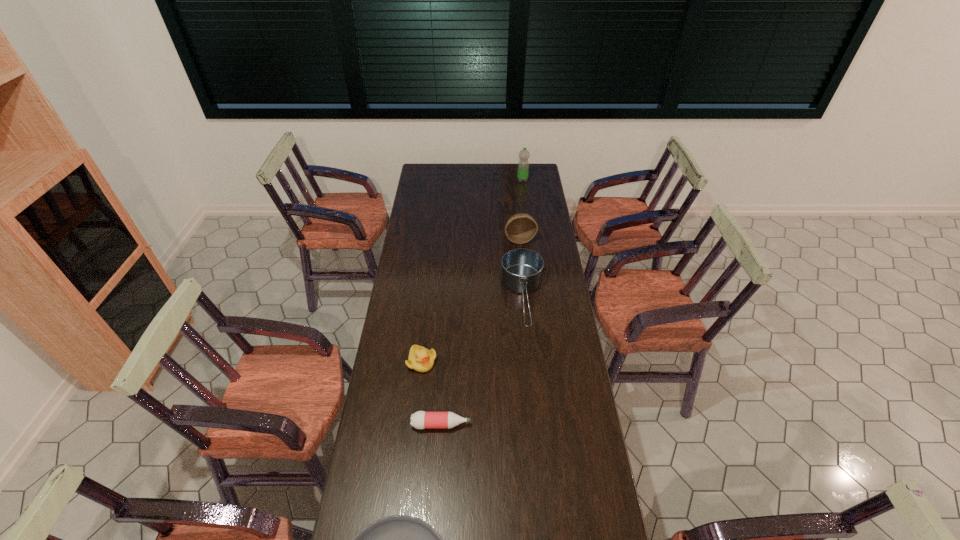
Find the location of `free spot between the bottle and the third tallest object`. free spot between the bottle and the third tallest object is located at coordinates (482, 362).

Where is `vacant area that lies between the fifth farthest object and the bowl`? vacant area that lies between the fifth farthest object and the bowl is located at coordinates (481, 332).

Find the location of a particular element. The image size is (960, 540). free spot between the second shortest object and the tallest object is located at coordinates (482, 302).

This screenshot has width=960, height=540. I want to click on free space between the bottle and the farthest object, so click(482, 302).

Locate an element on the screen. free area in between the duckling and the fourth shortest object is located at coordinates (472, 330).

Locate which object ranks second in proximity to the duckling. Please provide its 2D coordinates. Your answer should be formatted as a tuple, i.e. [(x, y)], where the tuple contains the x and y coordinates of a point satisfying the conditions above.

[(521, 269)]

Locate which object ranks second in proximity to the tallest object. Please provide its 2D coordinates. Your answer should be formatted as a tuple, i.e. [(x, y)], where the tuple contains the x and y coordinates of a point satisfying the conditions above.

[(521, 269)]

This screenshot has height=540, width=960. Find the location of `vacant point that satisfies the following two spatial constraints: 1. on the front side of the tallest object; 2. with the cap open on the second nearest object`. vacant point that satisfies the following two spatial constraints: 1. on the front side of the tallest object; 2. with the cap open on the second nearest object is located at coordinates (554, 424).

Locate an element on the screen. This screenshot has width=960, height=540. free space that satisfies the following two spatial constraints: 1. on the front side of the fifth nearest object; 2. with the cap open on the second nearest object is located at coordinates (539, 424).

The image size is (960, 540). I want to click on free point that satisfies the following two spatial constraints: 1. with the handle extending from one side of the fourth shortest object; 2. with the cap open on the second shortest object, so (535, 424).